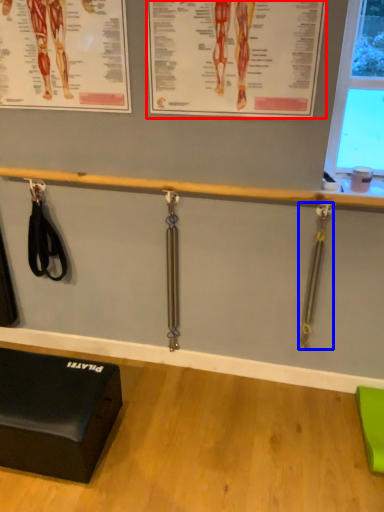
Question: Which of the following is the closest to the observer, poster page (highlighted by a red box) or weight (highlighted by a blue box)?

Choices:
 (A) poster page
 (B) weight

Answer: (A)